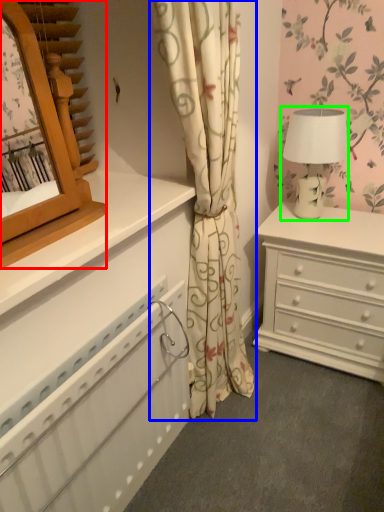
Question: Which object is the closest to the mirror (highlighted by a red box)? Choose among these: curtain (highlighted by a blue box) or table lamp (highlighted by a green box).

Choices:
 (A) curtain
 (B) table lamp

Answer: (A)